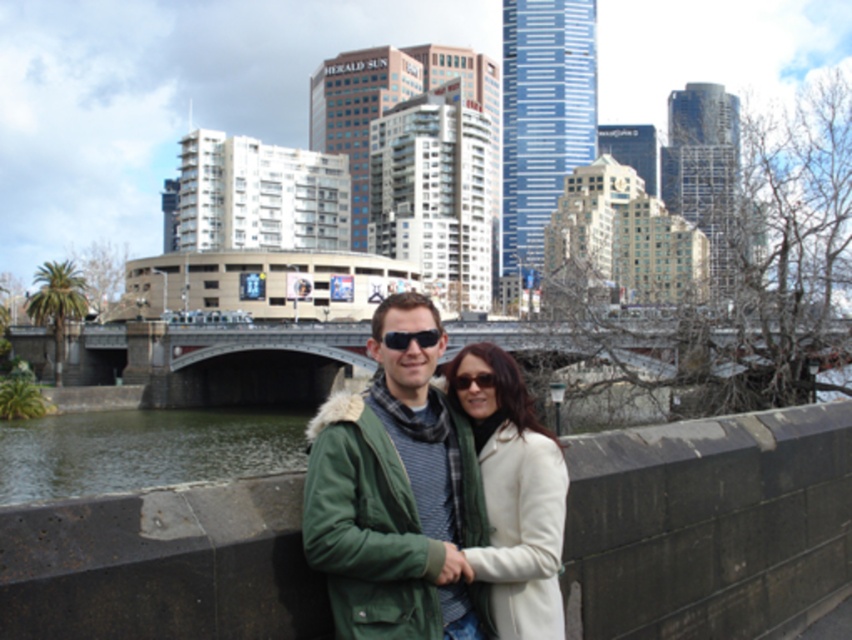
Is point (455, 611) positioned before point (209, 428)?

Yes.

Is point (481, 620) more distant than point (49, 444)?

No, it is not.

Find the location of a particular element. green fabric coat at center is located at coordinates (396, 497).

Who is lower down, concrete ledge at center or green fabric coat at center?

concrete ledge at center

Is concrete ledge at center to the right of green fabric coat at center from the viewer's perspective?

Correct, you'll find concrete ledge at center to the right of green fabric coat at center.

I want to click on concrete ledge at center, so click(707, 524).

Does point (75, 541) lie in front of point (429, 337)?

That is True.

Consider the image. Who is lower down, concrete ledge at center or black plastic sunglasses at center?

concrete ledge at center

At what (x,y) coordinates should I click in order to perform the action: click on concrete ledge at center. Please return your answer as a coordinate pair (x, y). The width and height of the screenshot is (852, 640). Looking at the image, I should click on (707, 524).